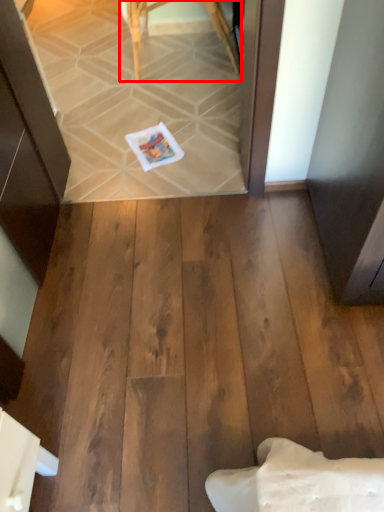
Question: From the image's perspective, what is the correct spatial positioning of furniture (annotated by the red box) in reference to postcard?

Choices:
 (A) above
 (B) below

Answer: (A)